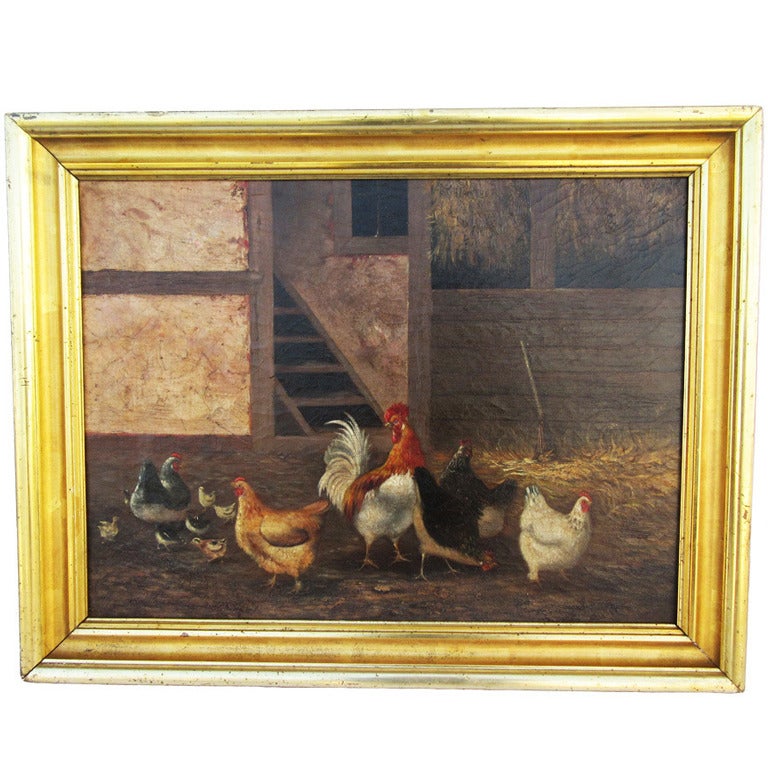
Find the location of `window`. window is located at coordinates (379, 209).